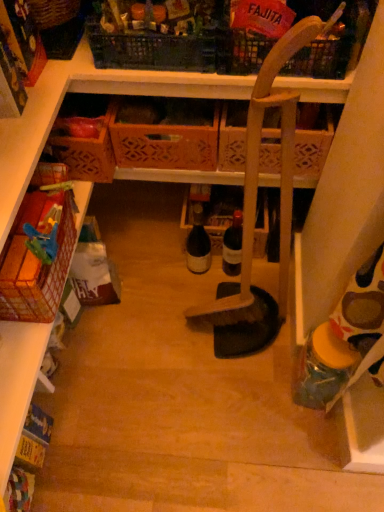
The height and width of the screenshot is (512, 384). What are the coordinates of `free space in front of matte glass bottle at center, the first bottle when ordered from left to right` in the screenshot? It's located at (194, 302).